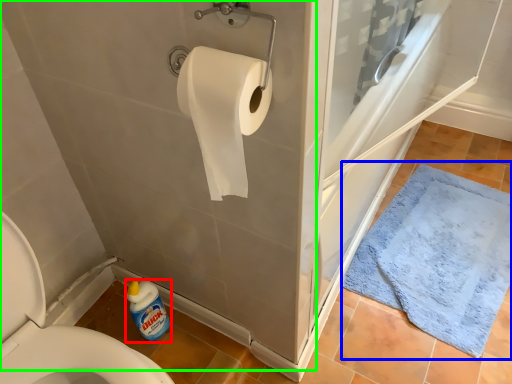
Question: Which is farther away from cleaning product (highlighted by a red box)? bath mat (highlighted by a blue box) or bath (highlighted by a green box)?

Choices:
 (A) bath mat
 (B) bath

Answer: (A)